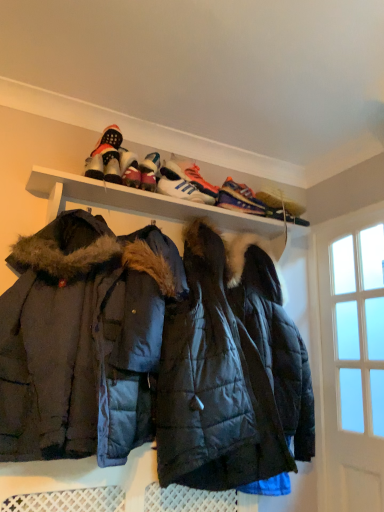
In order to click on free spot above white matte shelf at upper center (from a real-world perspective) in this screenshot , I will do `click(178, 197)`.